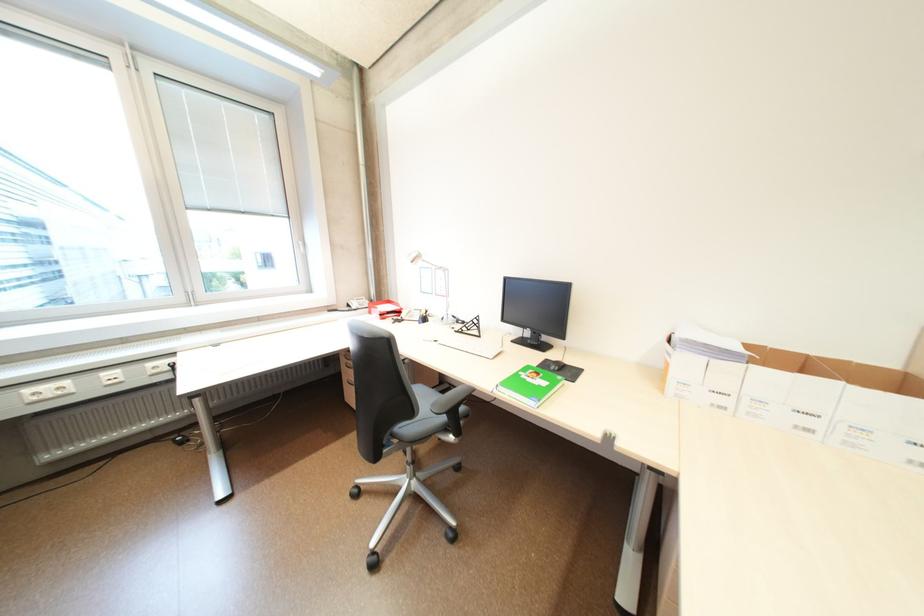
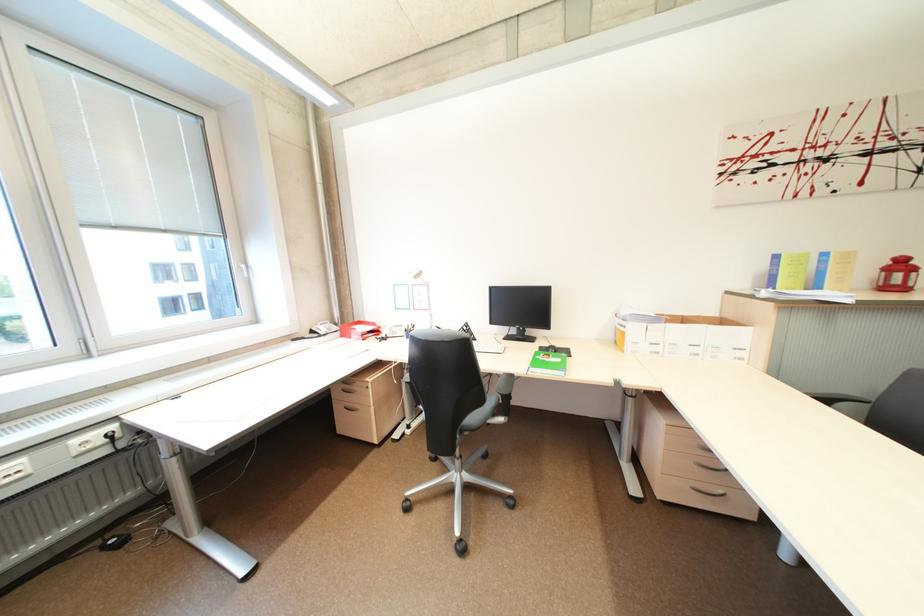
Locate, in the second image, the point that corresponds to [568,371] in the first image.

(565, 353)